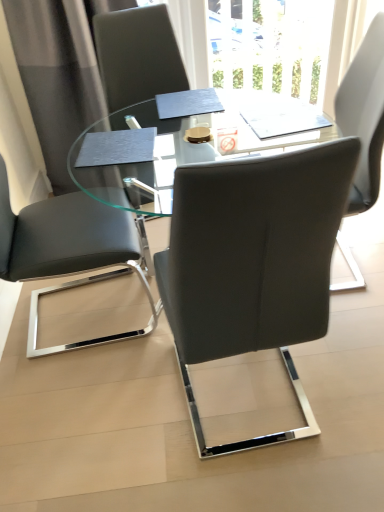
The image size is (384, 512). In order to click on free spot in front of transparent glass table at center in this screenshot , I will do `click(210, 442)`.